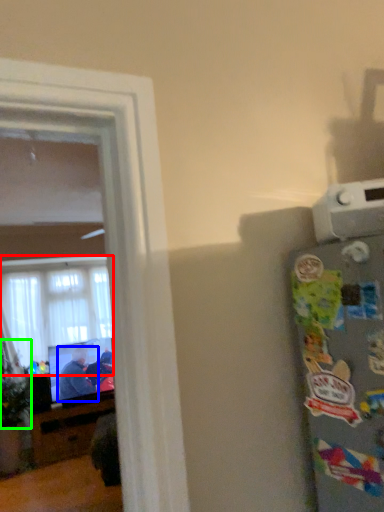
Question: Which object is positioned farthest from window (highlighted by a red box)? Select from person (highlighted by a blue box) and plant (highlighted by a green box).

Choices:
 (A) person
 (B) plant

Answer: (A)